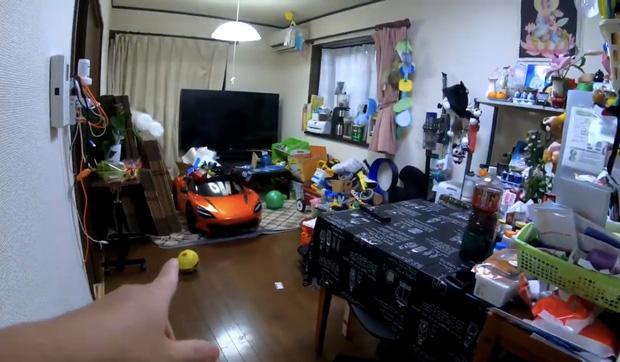
The width and height of the screenshot is (620, 362). Identify the location of curtains. (343, 73), (172, 55), (387, 62).